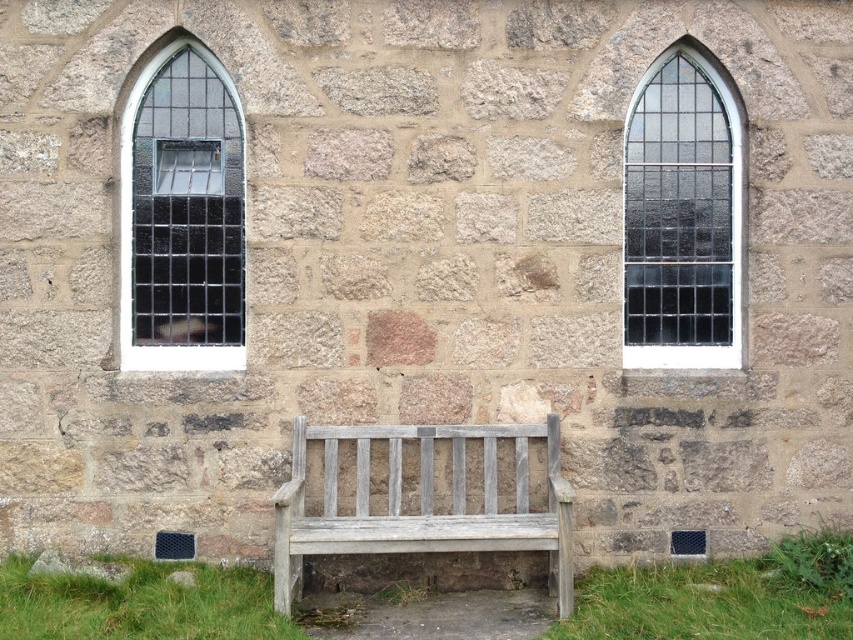
Question: Which of these objects is positioned closest to the green grass at lower center?

Choices:
 (A) clear glass window at center right
 (B) dark glass window at left
 (C) weathered wood bench at center

Answer: (C)

Question: Estimate the real-world distances between objects in this image. Which object is closer to the green grass at lower center?

Choices:
 (A) green grass at lower left
 (B) dark glass window at left

Answer: (A)

Question: Does clear glass window at center right lie behind weathered wood bench at center?

Choices:
 (A) no
 (B) yes

Answer: (B)

Question: Does dark glass window at left appear on the left side of green grass at lower center?

Choices:
 (A) yes
 (B) no

Answer: (A)

Question: Which object appears closest to the camera in this image?

Choices:
 (A) green grass at lower center
 (B) weathered wood bench at center
 (C) dark glass window at left

Answer: (A)

Question: Does dark glass window at left appear under clear glass window at center right?

Choices:
 (A) yes
 (B) no

Answer: (A)